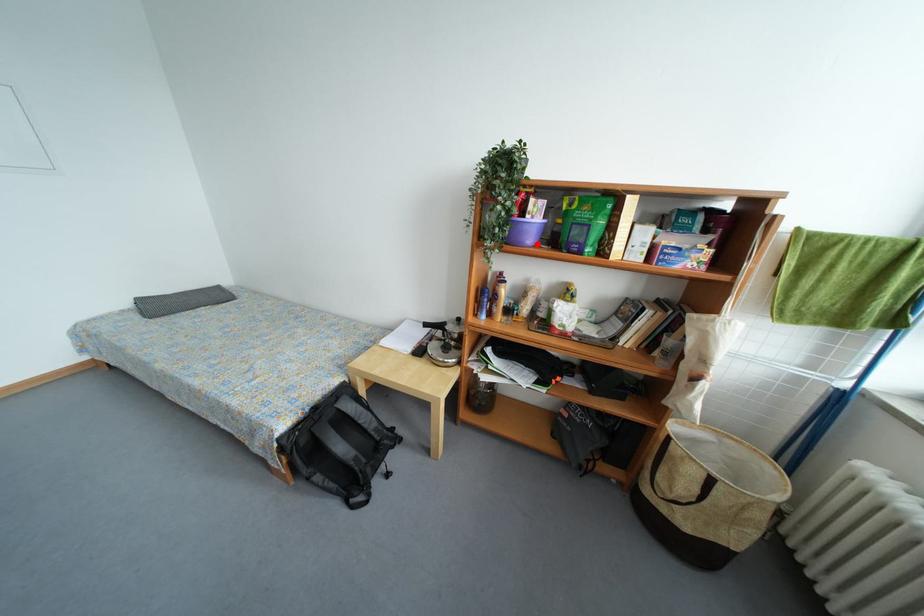
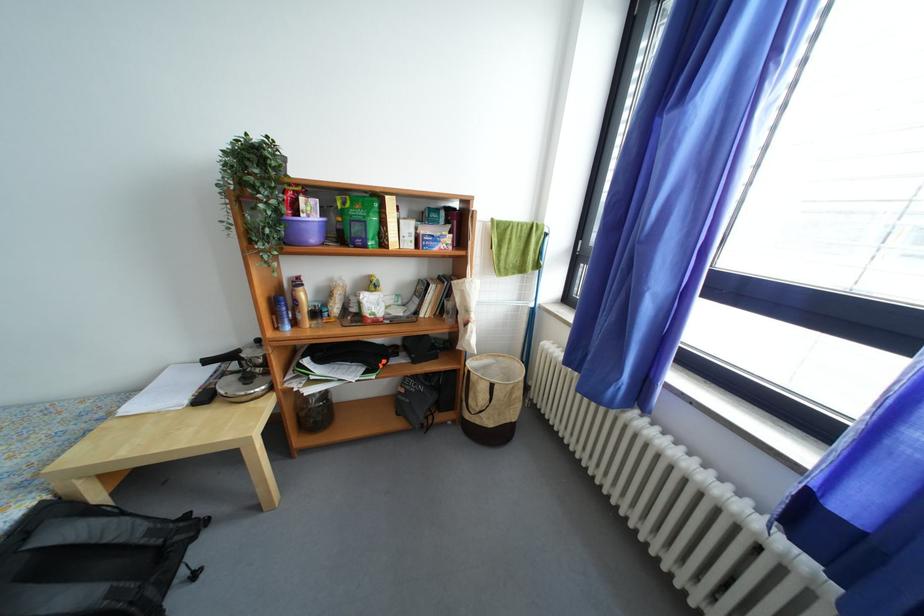
Find the pixel in the second image that matches the highlighted location in the first image.

(320, 243)